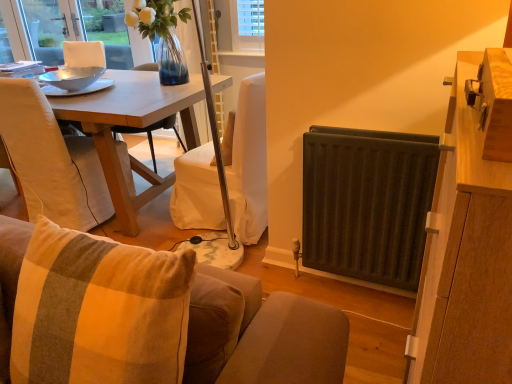
Question: Is the position of dark gray metal radiator at right less distant than that of wooden cabinet at right?

Choices:
 (A) no
 (B) yes

Answer: (A)

Question: Considering the relative positions of dark gray metal radiator at right and wooden cabinet at right in the image provided, is dark gray metal radiator at right to the right of wooden cabinet at right from the viewer's perspective?

Choices:
 (A) yes
 (B) no

Answer: (B)

Question: Does dark gray metal radiator at right have a lesser width compared to wooden cabinet at right?

Choices:
 (A) yes
 (B) no

Answer: (A)

Question: Is dark gray metal radiator at right shorter than wooden cabinet at right?

Choices:
 (A) yes
 (B) no

Answer: (A)

Question: Does dark gray metal radiator at right have a greater width compared to wooden cabinet at right?

Choices:
 (A) yes
 (B) no

Answer: (B)

Question: From the image's perspective, is beige fabric chair at left located above or below dark gray metal radiator at right?

Choices:
 (A) above
 (B) below

Answer: (A)

Question: Considering their positions, is beige fabric chair at left located in front of or behind dark gray metal radiator at right?

Choices:
 (A) behind
 (B) front

Answer: (A)

Question: Is point (110, 208) positioned closer to the camera than point (344, 268)?

Choices:
 (A) closer
 (B) farther

Answer: (B)

Question: Which is correct: beige fabric chair at left is inside dark gray metal radiator at right, or outside of it?

Choices:
 (A) inside
 (B) outside

Answer: (B)

Question: Which is correct: dark gray metal radiator at right is inside wooden table at center, or outside of it?

Choices:
 (A) inside
 (B) outside

Answer: (B)

Question: From a real-world perspective, is dark gray metal radiator at right above or below wooden table at center?

Choices:
 (A) above
 (B) below

Answer: (A)

Question: Is dark gray metal radiator at right bigger or smaller than wooden table at center?

Choices:
 (A) big
 (B) small

Answer: (B)

Question: Relative to wooden table at center, is dark gray metal radiator at right in front or behind?

Choices:
 (A) front
 (B) behind

Answer: (A)

Question: Is dark gray metal radiator at right wider or thinner than plush fabric couch at lower center?

Choices:
 (A) thin
 (B) wide

Answer: (A)

Question: From a real-world perspective, relative to plush fabric couch at lower center, is dark gray metal radiator at right vertically above or below?

Choices:
 (A) above
 (B) below

Answer: (B)